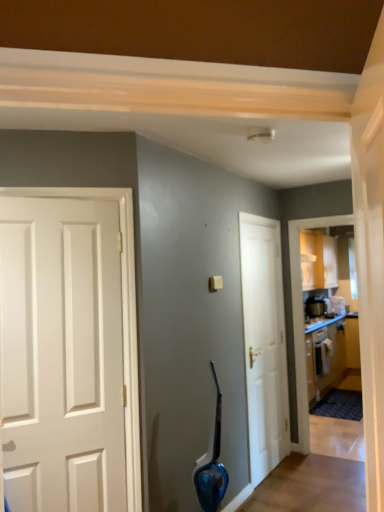
The height and width of the screenshot is (512, 384). What do you see at coordinates (264, 344) in the screenshot? I see `white glossy door at center` at bounding box center [264, 344].

Find the location of `metallic silver toaster at upper right, which is the first appliance in right-to-left order`. metallic silver toaster at upper right, which is the first appliance in right-to-left order is located at coordinates (336, 305).

Where is `metallic silver toaster at right, which is the 1th appliance in left-to-right order`? This screenshot has height=512, width=384. metallic silver toaster at right, which is the 1th appliance in left-to-right order is located at coordinates (315, 307).

Considering the relative positions of wooden cabinetry at right and white glossy door at center in the image provided, is wooden cabinetry at right behind white glossy door at center?

Yes.

From the image's perspective, between wooden cabinetry at right and white glossy door at center, who is located below?

wooden cabinetry at right is shown below in the image.

Considering the relative positions of wooden cabinetry at right and white glossy door at center in the image provided, is wooden cabinetry at right to the left of white glossy door at center from the viewer's perspective?

No, wooden cabinetry at right is not to the left of white glossy door at center.

Considering the sizes of wooden cabinetry at right and white glossy door at center in the image, is wooden cabinetry at right taller or shorter than white glossy door at center?

In the image, wooden cabinetry at right appears to be shorter than white glossy door at center.

Does white glossy door at center appear on the right side of metallic silver toaster at upper right, the second appliance in the left-to-right sequence?

In fact, white glossy door at center is to the left of metallic silver toaster at upper right, the second appliance in the left-to-right sequence.

In terms of width, does white glossy door at center look wider or thinner when compared to metallic silver toaster at upper right, which is the first appliance in right-to-left order?

Considering their sizes, white glossy door at center looks slimmer than metallic silver toaster at upper right, which is the first appliance in right-to-left order.

Considering the relative sizes of white glossy door at center and metallic silver toaster at upper right, which is the first appliance in right-to-left order, in the image provided, is white glossy door at center smaller than metallic silver toaster at upper right, which is the first appliance in right-to-left order,?

Incorrect, white glossy door at center is not smaller in size than metallic silver toaster at upper right, which is the first appliance in right-to-left order.

Is white glossy door at center further to the viewer compared to wooden cabinetry at right?

No, it is not.

Measure the distance between white glossy door at center and wooden cabinetry at right.

white glossy door at center is 2.24 meters from wooden cabinetry at right.

From the image's perspective, relative to wooden cabinetry at right, is white glossy door at center above or below?

white glossy door at center is situated higher than wooden cabinetry at right in the image.

From the picture: Can you tell me how much white glossy door at center and wooden cabinetry at right differ in facing direction?

white glossy door at center and wooden cabinetry at right are facing 0.758 degrees away from each other.

Does point (323, 300) come behind point (340, 303)?

No, (323, 300) is in front of (340, 303).

Could you measure the distance between metallic silver toaster at right, which is the 1th appliance in left-to-right order, and metallic silver toaster at upper right, the second appliance in the left-to-right sequence?

13.00 inches.

In terms of width, does metallic silver toaster at right, which is the 1th appliance in left-to-right order, look wider or thinner when compared to metallic silver toaster at upper right, which is the first appliance in right-to-left order?

Considering their sizes, metallic silver toaster at right, which is the 1th appliance in left-to-right order, looks slimmer than metallic silver toaster at upper right, which is the first appliance in right-to-left order.

Are metallic silver toaster at right, which is the 1th appliance in left-to-right order, and metallic silver toaster at upper right, the second appliance in the left-to-right sequence, far apart?

Actually, metallic silver toaster at right, which is the 1th appliance in left-to-right order, and metallic silver toaster at upper right, the second appliance in the left-to-right sequence, are a little close together.

Can you confirm if metallic silver toaster at upper right, which is the first appliance in right-to-left order, is bigger than white glossy door at center?

Actually, metallic silver toaster at upper right, which is the first appliance in right-to-left order, might be smaller than white glossy door at center.

Which object is closer to the camera, metallic silver toaster at upper right, which is the first appliance in right-to-left order, or white glossy door at center?

white glossy door at center.

Between metallic silver toaster at upper right, which is the first appliance in right-to-left order, and white glossy door at center, which one has less height?

With less height is metallic silver toaster at upper right, which is the first appliance in right-to-left order.

Between metallic silver toaster at upper right, the second appliance in the left-to-right sequence, and white glossy door at center, which one has smaller width?

white glossy door at center.

Are white glossy door at center and metallic silver toaster at right, acting as the second appliance starting from the right, located far from each other?

white glossy door at center is far away from metallic silver toaster at right, acting as the second appliance starting from the right.

Considering the positions of objects white glossy door at center and metallic silver toaster at right, which is the 1th appliance in left-to-right order, in the image provided, who is more to the left, white glossy door at center or metallic silver toaster at right, which is the 1th appliance in left-to-right order,?

Positioned to the left is white glossy door at center.

From the image's perspective, is white glossy door at center located beneath metallic silver toaster at right, which is the 1th appliance in left-to-right order?

Correct, white glossy door at center appears lower than metallic silver toaster at right, which is the 1th appliance in left-to-right order, in the image.

Based on their sizes in the image, would you say white glossy door at center is bigger or smaller than metallic silver toaster at right, which is the 1th appliance in left-to-right order?

Clearly, white glossy door at center is larger in size than metallic silver toaster at right, which is the 1th appliance in left-to-right order.

How many degrees apart are the facing directions of metallic silver toaster at right, which is the 1th appliance in left-to-right order, and wooden cabinetry at right?

0.295 degrees.

Does point (311, 310) come in front of point (327, 378)?

That is False.

Based on the photo, from the image's perspective, is metallic silver toaster at right, which is the 1th appliance in left-to-right order, beneath wooden cabinetry at right?

No, from the image's perspective, metallic silver toaster at right, which is the 1th appliance in left-to-right order, is not beneath wooden cabinetry at right.

From a real-world perspective, is metallic silver toaster at right, which is the 1th appliance in left-to-right order, physically located above or below wooden cabinetry at right?

metallic silver toaster at right, which is the 1th appliance in left-to-right order, is above wooden cabinetry at right.

You are a GUI agent. You are given a task and a screenshot of the screen. Output one action in this format:
    pyautogui.click(x=<x>, y=<y>)
    Task: Click on the cabinetry on the right side of white glossy door at center
    This screenshot has height=512, width=384.
    Given the screenshot: What is the action you would take?
    click(325, 356)

Locate an element on the screen. The image size is (384, 512). door located on the left of metallic silver toaster at upper right, which is the first appliance in right-to-left order is located at coordinates (264, 344).

From the image, which object appears to be farther from metallic silver toaster at right, which is the 1th appliance in left-to-right order, metallic silver toaster at upper right, the second appliance in the left-to-right sequence, or white glossy door at center?

white glossy door at center is positioned further to the anchor metallic silver toaster at right, which is the 1th appliance in left-to-right order.

Estimate the real-world distances between objects in this image. Which object is further from wooden cabinetry at right, metallic silver toaster at right, acting as the second appliance starting from the right, or white glossy door at center?

white glossy door at center is positioned further to the anchor wooden cabinetry at right.

Estimate the real-world distances between objects in this image. Which object is closer to white glossy door at center, metallic silver toaster at upper right, which is the first appliance in right-to-left order, or wooden cabinetry at right?

The object closer to white glossy door at center is wooden cabinetry at right.

Which object lies nearer to the anchor point white glossy door at center, wooden cabinetry at right or metallic silver toaster at upper right, which is the first appliance in right-to-left order?

wooden cabinetry at right is closer to white glossy door at center.

When comparing their distances from metallic silver toaster at upper right, which is the first appliance in right-to-left order, does metallic silver toaster at right, acting as the second appliance starting from the right, or white glossy door at center seem closer?

metallic silver toaster at right, acting as the second appliance starting from the right, is positioned closer to the anchor metallic silver toaster at upper right, which is the first appliance in right-to-left order.

Considering their positions, is metallic silver toaster at right, which is the 1th appliance in left-to-right order, positioned closer to white glossy door at center than metallic silver toaster at upper right, the second appliance in the left-to-right sequence?

metallic silver toaster at right, which is the 1th appliance in left-to-right order, is closer to white glossy door at center.

Estimate the real-world distances between objects in this image. Which object is closer to metallic silver toaster at right, which is the 1th appliance in left-to-right order, white glossy door at center or metallic silver toaster at upper right, the second appliance in the left-to-right sequence?

The object closer to metallic silver toaster at right, which is the 1th appliance in left-to-right order, is metallic silver toaster at upper right, the second appliance in the left-to-right sequence.

Looking at the image, which one is located further to metallic silver toaster at upper right, the second appliance in the left-to-right sequence, white glossy door at center or wooden cabinetry at right?

white glossy door at center lies further to metallic silver toaster at upper right, the second appliance in the left-to-right sequence, than the other object.

At what (x,y) coordinates should I click in order to perform the action: click on appliance between white glossy door at center and metallic silver toaster at upper right, which is the first appliance in right-to-left order, along the z-axis. Please return your answer as a coordinate pair (x, y). Image resolution: width=384 pixels, height=512 pixels. Looking at the image, I should click on (315, 307).

Where is `cabinetry located between white glossy door at center and metallic silver toaster at right, acting as the second appliance starting from the right, in the depth direction`? cabinetry located between white glossy door at center and metallic silver toaster at right, acting as the second appliance starting from the right, in the depth direction is located at coordinates (325, 356).

I want to click on appliance between wooden cabinetry at right and metallic silver toaster at upper right, the second appliance in the left-to-right sequence, along the z-axis, so click(x=315, y=307).

You are a GUI agent. You are given a task and a screenshot of the screen. Output one action in this format:
    pyautogui.click(x=<x>, y=<y>)
    Task: Click on the cabinetry between white glossy door at center and metallic silver toaster at upper right, the second appliance in the left-to-right sequence, in the front-back direction
    The width and height of the screenshot is (384, 512).
    Given the screenshot: What is the action you would take?
    pyautogui.click(x=325, y=356)